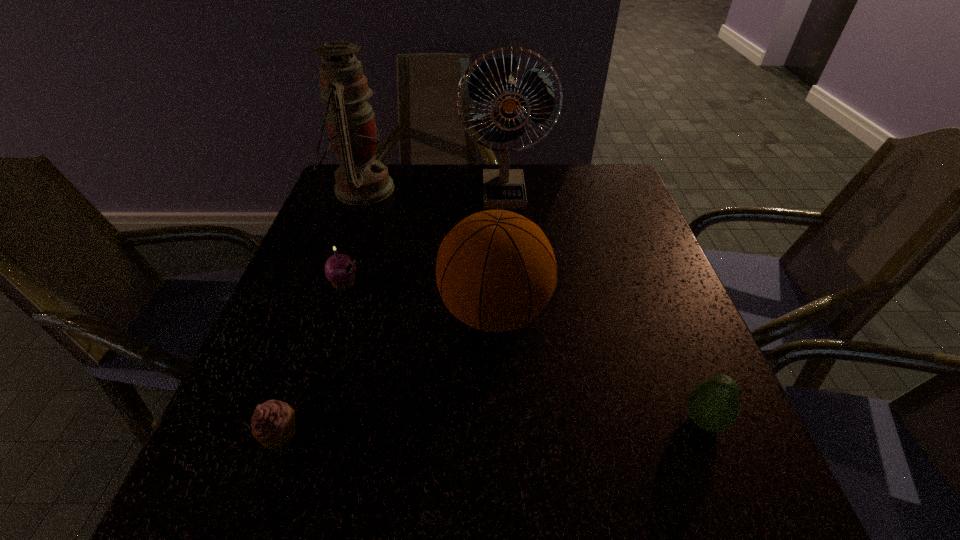
Identify the location of blank area in the image that satisfies the following two spatial constraints: 1. on the face of the third tallest object; 2. on the right side of the taller cupcake. (335, 312).

Locate an element on the screen. This screenshot has width=960, height=540. vacant space that satisfies the following two spatial constraints: 1. on the face of the taller cupcake; 2. on the front side of the shorter cupcake is located at coordinates (296, 433).